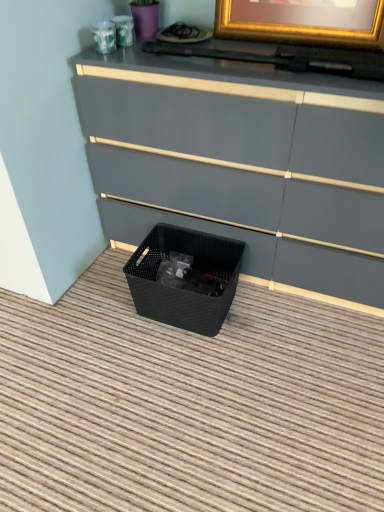
This screenshot has width=384, height=512. What are the coordinates of `free location in front of black woven basket at lower center` in the screenshot? It's located at (185, 368).